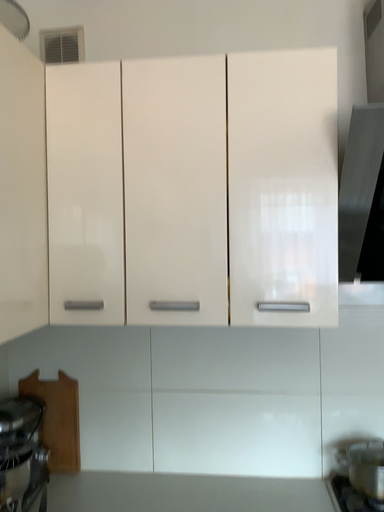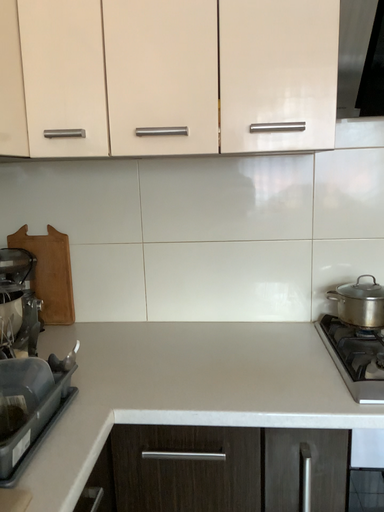
Question: How did the camera likely rotate when shooting the video?

Choices:
 (A) rotated downward
 (B) rotated upward

Answer: (A)